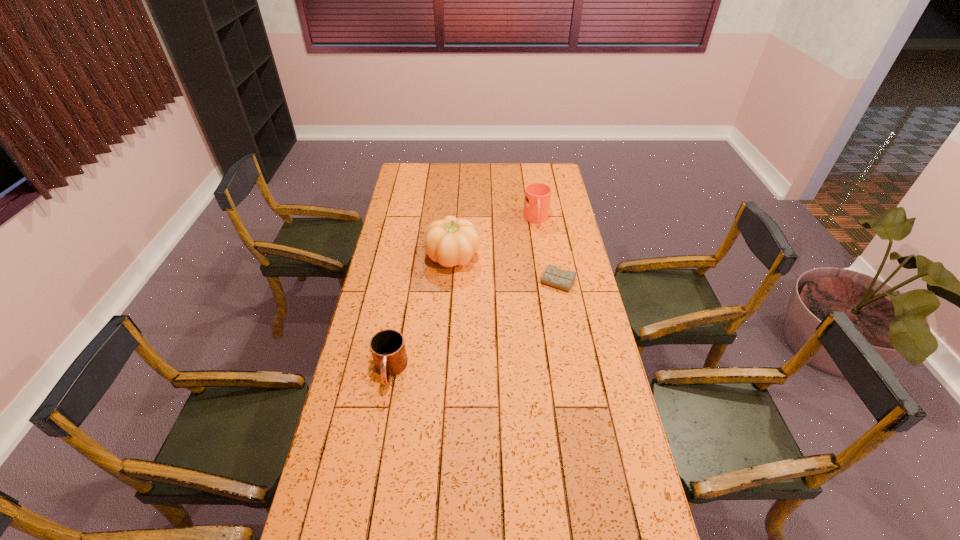
The image size is (960, 540). In order to click on vacant point located between the shortest object and the second object from left to right in this screenshot , I will do `click(505, 269)`.

What are the coordinates of `vacant space that is in between the nearest object and the shortest object` in the screenshot? It's located at (474, 326).

Locate an element on the screen. Image resolution: width=960 pixels, height=540 pixels. vacant area that lies between the diary and the shorter mug is located at coordinates (474, 326).

Identify the location of unoccupied position between the tallest object and the second shortest object. Image resolution: width=960 pixels, height=540 pixels. (421, 313).

The image size is (960, 540). I want to click on empty space that is in between the nearest object and the diary, so click(x=474, y=326).

I want to click on free point between the taller mug and the left mug, so click(x=463, y=295).

You are a GUI agent. You are given a task and a screenshot of the screen. Output one action in this format:
    pyautogui.click(x=<x>, y=<y>)
    Task: Click on the vacant area between the taller mug and the tallest object
    Image resolution: width=960 pixels, height=540 pixels.
    Given the screenshot: What is the action you would take?
    pyautogui.click(x=494, y=238)

The image size is (960, 540). Identify the location of empty space between the shorter mug and the tallest object. (421, 313).

What are the coordinates of `unoccupied area between the shortest object and the nearest object` in the screenshot? It's located at (474, 326).

Where is `object identified as the third closest to the tallest object`? object identified as the third closest to the tallest object is located at coordinates (388, 350).